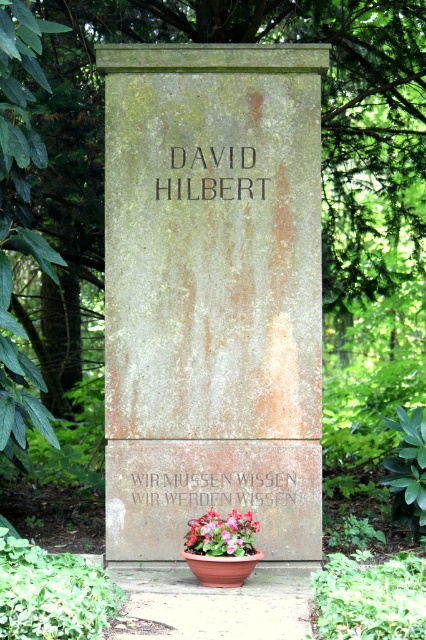
Question: Which point is closer to the camera taking this photo?

Choices:
 (A) coord(227,554)
 (B) coord(181,156)
 (C) coord(54,52)
 (D) coord(238,500)

Answer: (A)

Question: Among these objects, which one is farthest from the camera?

Choices:
 (A) floral arrangement at center
 (B) black stone writing at center

Answer: (B)

Question: Can you confirm if green leafy tree at upper center is wider than floral arrangement at center?

Choices:
 (A) no
 (B) yes

Answer: (B)

Question: Is black stone writing at center above floral arrangement at center?

Choices:
 (A) no
 (B) yes

Answer: (B)

Question: Is green leafy tree at upper center positioned before dark brown stone engraving at center?

Choices:
 (A) no
 (B) yes

Answer: (A)

Question: Which point is closer to the camera?

Choices:
 (A) (291, 131)
 (B) (80, 269)

Answer: (A)